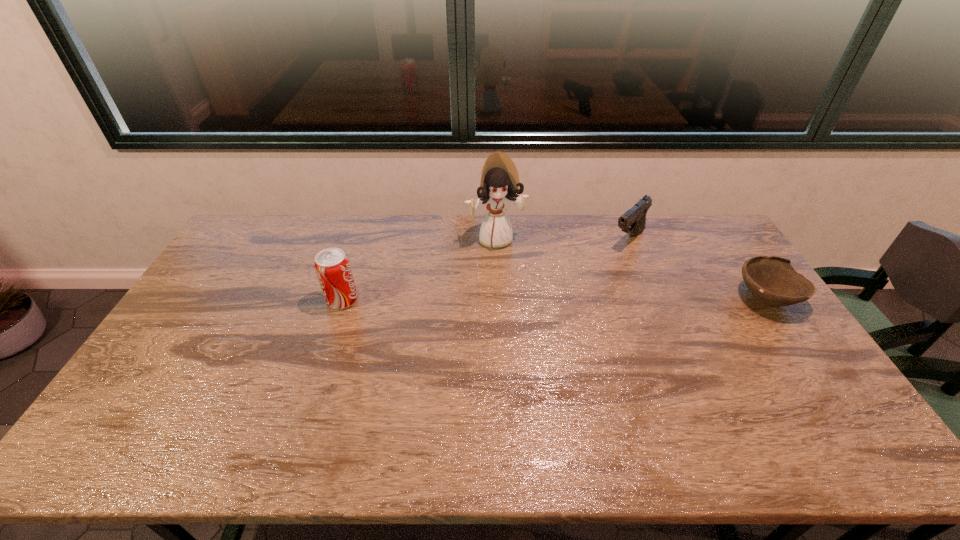
Find the location of a particular element. The image size is (960, 540). free space that is in between the pistol and the soda can is located at coordinates (485, 270).

Locate an element on the screen. free space between the soda can and the third object from right to left is located at coordinates (419, 269).

Where is `vacant region between the leftmost object and the shortest object`? The height and width of the screenshot is (540, 960). vacant region between the leftmost object and the shortest object is located at coordinates (554, 299).

The height and width of the screenshot is (540, 960). Identify the location of unoccupied position between the third tallest object and the leftmost object. (485, 270).

The image size is (960, 540). Find the location of `free spot between the doll and the third object from left to right`. free spot between the doll and the third object from left to right is located at coordinates (562, 239).

The image size is (960, 540). Find the location of `object that can be found as the third closest to the tallest object`. object that can be found as the third closest to the tallest object is located at coordinates (772, 280).

This screenshot has height=540, width=960. Identify the location of object that is the closest to the shortest object. (633, 221).

Find the location of a particular element. This screenshot has height=540, width=960. free space that satisfies the following two spatial constraints: 1. on the back side of the soda can; 2. on the left side of the shortest object is located at coordinates (343, 298).

I want to click on free space that satisfies the following two spatial constraints: 1. on the front side of the pistol; 2. on the right side of the bowl, so click(652, 298).

Find the location of a particular element. The height and width of the screenshot is (540, 960). free region that satisfies the following two spatial constraints: 1. on the front side of the pistol; 2. on the left side of the shortest object is located at coordinates coord(652,298).